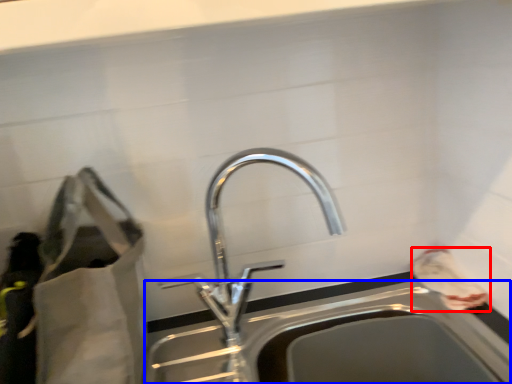
Question: Which object is further to the camera taking this photo, bag (highlighted by a red box) or sink (highlighted by a blue box)?

Choices:
 (A) bag
 (B) sink

Answer: (A)